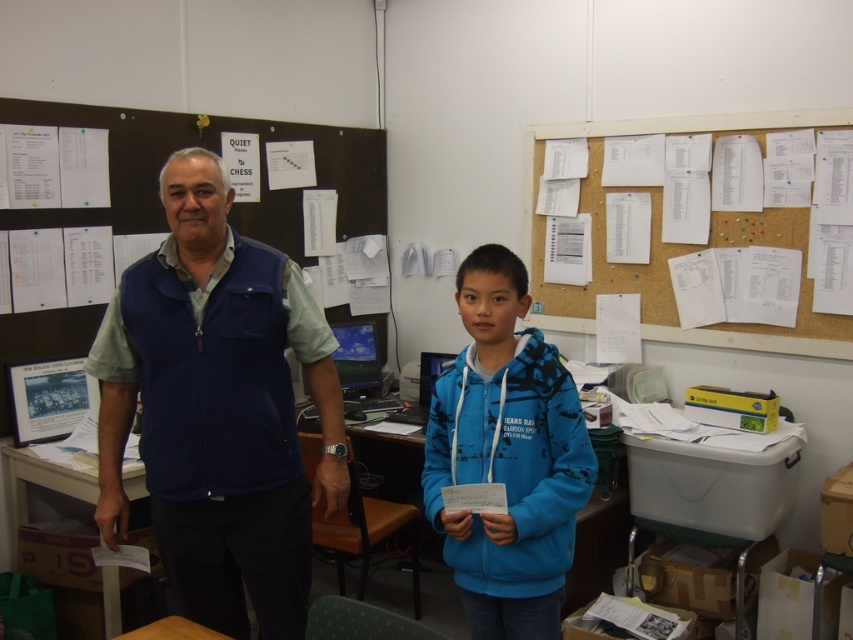
Question: Can you confirm if white paper at upper right is thinner than white plastic table at center?

Choices:
 (A) no
 (B) yes

Answer: (A)

Question: Is brown corkboard at upper left wider than white plastic table at center?

Choices:
 (A) yes
 (B) no

Answer: (A)

Question: Which point is closer to the camera?

Choices:
 (A) (80, 497)
 (B) (120, 138)
 (C) (511, 467)

Answer: (C)

Question: Can you confirm if brown corkboard at upper left is positioned to the left of white plastic table at center?

Choices:
 (A) no
 (B) yes

Answer: (A)

Question: Which point is farther to the camera?

Choices:
 (A) (45, 122)
 (B) (740, 132)
 (C) (416, 476)

Answer: (C)

Question: Which point is closer to the camera taking this photo?

Choices:
 (A) (547, 444)
 (B) (189, 596)
 (C) (592, 520)
 (D) (732, 116)

Answer: (A)